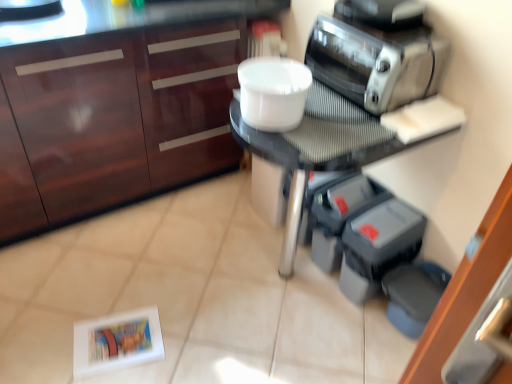
What are the coordinates of `free spot in front of gray plastic containers at lower right, the 1th appliance when ordered from left to right` in the screenshot? It's located at (323, 299).